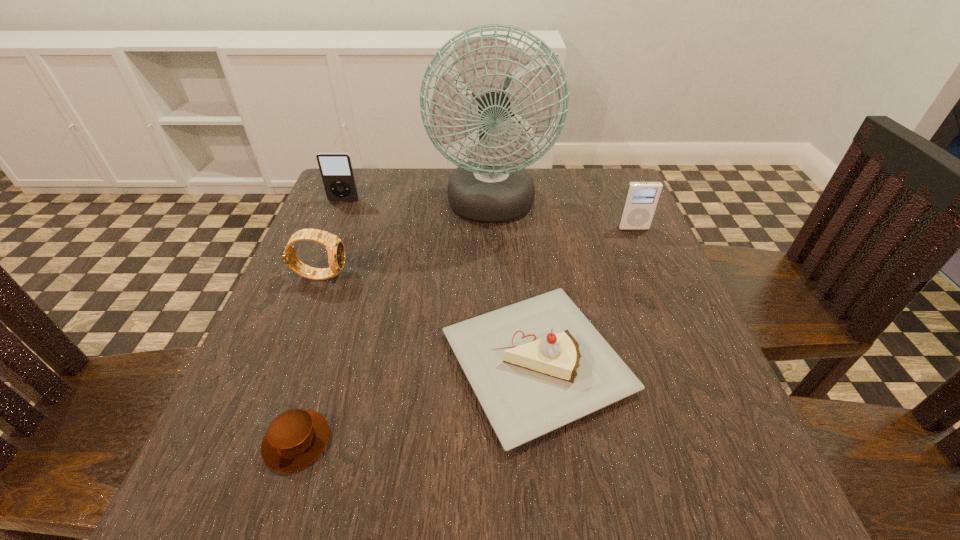
Find the location of a particular element. The height and width of the screenshot is (540, 960). vacant space that is in between the rightmost object and the watch is located at coordinates (477, 251).

The width and height of the screenshot is (960, 540). In order to click on free space between the fan and the shortest object in this screenshot , I will do `click(394, 324)`.

At what (x,y) coordinates should I click in order to perform the action: click on empty space that is in between the muffin and the fifth tallest object. Please return your answer as a coordinate pair (x, y). Looking at the image, I should click on (417, 402).

This screenshot has height=540, width=960. Find the location of `free space between the nearer iPod and the second shortest object`. free space between the nearer iPod and the second shortest object is located at coordinates (586, 296).

Locate an element on the screen. The width and height of the screenshot is (960, 540). free point between the shortest object and the left iPod is located at coordinates (321, 321).

Locate an element on the screen. The width and height of the screenshot is (960, 540). unoccupied area between the watch and the right iPod is located at coordinates (477, 251).

Identify the location of free space between the tallest object and the fourth farthest object. This screenshot has height=540, width=960. (406, 241).

You are a GUI agent. You are given a task and a screenshot of the screen. Output one action in this format:
    pyautogui.click(x=<x>, y=<y>)
    Task: Click on the third closest object to the cake
    
    Given the screenshot: What is the action you would take?
    pyautogui.click(x=335, y=248)

Locate an element on the screen. The width and height of the screenshot is (960, 540). the fifth closest object to the farther iPod is located at coordinates (641, 199).

Where is `free space that satisfies the following two spatial constraints: 1. on the face of the watch; 2. on the back side of the cake`? The height and width of the screenshot is (540, 960). free space that satisfies the following two spatial constraints: 1. on the face of the watch; 2. on the back side of the cake is located at coordinates (286, 363).